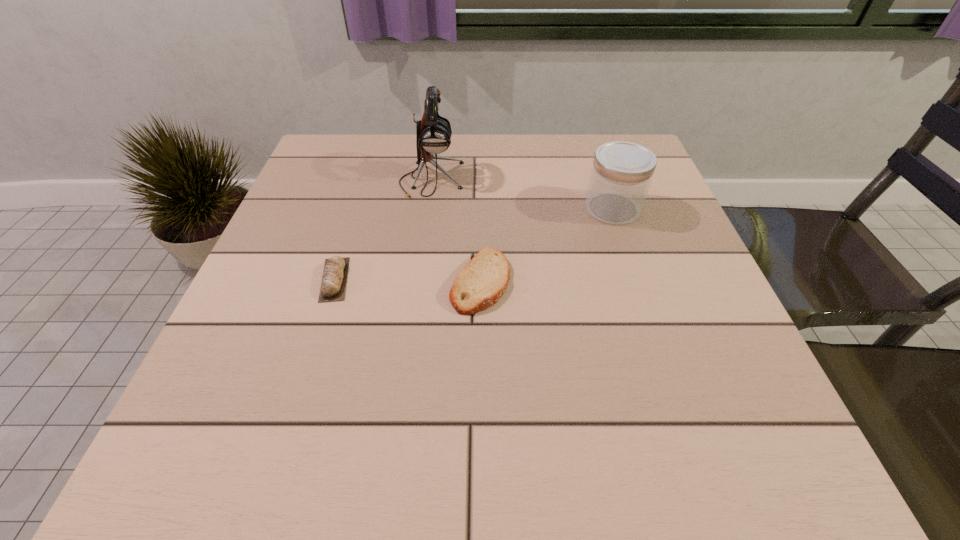
At what (x,y) coordinates should I click in order to perform the action: click on object located at the left edge. Please return your answer as a coordinate pair (x, y). The image size is (960, 540). Looking at the image, I should click on (333, 285).

Where is `object at the right edge`? The image size is (960, 540). object at the right edge is located at coordinates (621, 174).

Find the location of a particular element. free space at the far edge of the desktop is located at coordinates (422, 169).

The image size is (960, 540). Find the location of `free space at the left edge of the desktop`. free space at the left edge of the desktop is located at coordinates (301, 297).

This screenshot has width=960, height=540. Find the location of `vacant point at the far left corner`. vacant point at the far left corner is located at coordinates (348, 136).

You are a GUI agent. You are given a task and a screenshot of the screen. Output one action in this format:
    pyautogui.click(x=<x>, y=<y>)
    Task: Click on the free spot between the right pita bread and the rightmost object
    
    Given the screenshot: What is the action you would take?
    pyautogui.click(x=546, y=245)

Identify the location of blank region between the right pita bread and the third shortest object. (546, 245).

Locate an element on the screen. vacant space in between the tallest object and the right pita bread is located at coordinates (456, 231).

Where is `free spot between the right pita bread and the leftmost object`? free spot between the right pita bread and the leftmost object is located at coordinates (407, 280).

The width and height of the screenshot is (960, 540). I want to click on vacant area between the earphone and the left pita bread, so click(x=383, y=230).